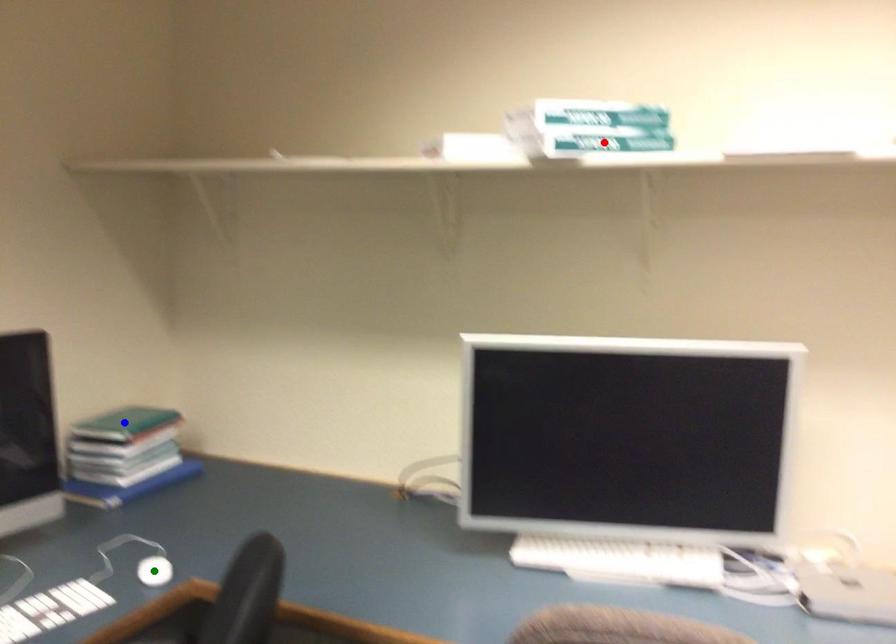
Order these from nearest to farthest:
A) red point
B) green point
C) blue point

red point, green point, blue point